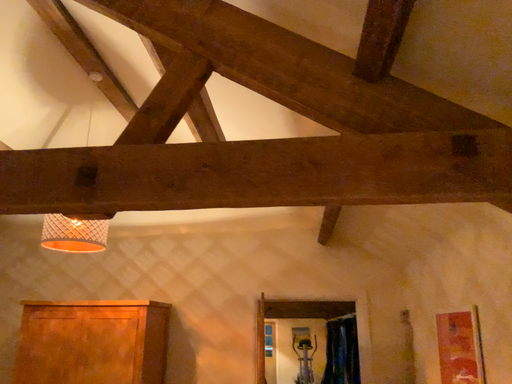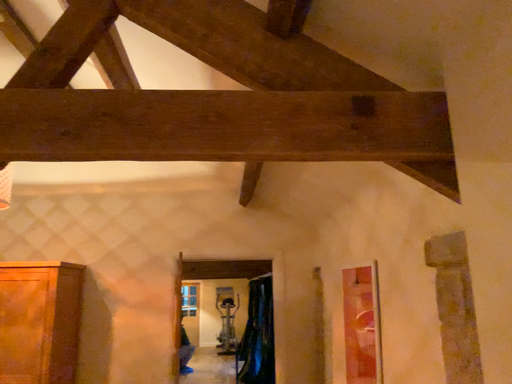
Question: How did the camera likely rotate when shooting the video?

Choices:
 (A) rotated right
 (B) rotated left

Answer: (A)